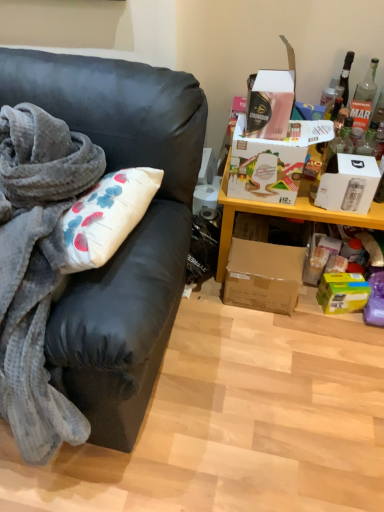
Question: Is white cardboard box at upper right, which is the 4th box from bottom to top, thinner than green matte box at lower right, which is the 4th box in top-to-bottom order?

Choices:
 (A) no
 (B) yes

Answer: (A)

Question: From the image's perspective, is white cardboard box at upper right, which is the 4th box from bottom to top, located beneath green matte box at lower right, which ranks as the 1th box in bottom-to-top order?

Choices:
 (A) no
 (B) yes

Answer: (A)

Question: Is green matte box at lower right, which ranks as the 1th box in bottom-to-top order, surrounded by white cardboard box at upper right, which is counted as the first box, starting from the top?

Choices:
 (A) yes
 (B) no

Answer: (B)

Question: Considering the relative sizes of white cardboard box at upper right, which is the 4th box from bottom to top, and green matte box at lower right, which is the 4th box in top-to-bottom order, in the image provided, is white cardboard box at upper right, which is the 4th box from bottom to top, bigger than green matte box at lower right, which is the 4th box in top-to-bottom order,?

Choices:
 (A) yes
 (B) no

Answer: (A)

Question: From a real-world perspective, is white cardboard box at upper right, which is counted as the first box, starting from the top, physically below green matte box at lower right, which ranks as the 1th box in bottom-to-top order?

Choices:
 (A) no
 (B) yes

Answer: (A)

Question: In the image, is white cardboard box at upper right, which is the 4th box from bottom to top, on the left side or the right side of matte black couch at left?

Choices:
 (A) right
 (B) left

Answer: (A)

Question: Looking at their shapes, would you say white cardboard box at upper right, which is counted as the first box, starting from the top, is wider or thinner than matte black couch at left?

Choices:
 (A) thin
 (B) wide

Answer: (A)

Question: From a real-world perspective, is white cardboard box at upper right, which is the 4th box from bottom to top, positioned above or below matte black couch at left?

Choices:
 (A) below
 (B) above

Answer: (B)

Question: Is white cardboard box at upper right, which is counted as the first box, starting from the top, inside or outside of matte black couch at left?

Choices:
 (A) outside
 (B) inside

Answer: (A)

Question: Considering the positions of brown cardboard box at lower right, acting as the second box starting from the bottom, and yellow wood shelf at upper right in the image, is brown cardboard box at lower right, acting as the second box starting from the bottom, wider or thinner than yellow wood shelf at upper right?

Choices:
 (A) wide
 (B) thin

Answer: (B)

Question: Which is correct: brown cardboard box at lower right, the third box when ordered from top to bottom, is inside yellow wood shelf at upper right, or outside of it?

Choices:
 (A) inside
 (B) outside

Answer: (A)

Question: In the image, is brown cardboard box at lower right, the third box when ordered from top to bottom, positioned in front of or behind yellow wood shelf at upper right?

Choices:
 (A) front
 (B) behind

Answer: (B)

Question: In terms of size, does brown cardboard box at lower right, the third box when ordered from top to bottom, appear bigger or smaller than yellow wood shelf at upper right?

Choices:
 (A) big
 (B) small

Answer: (B)

Question: From a real-world perspective, relative to white cardboard box at upper right, which is the 4th box from bottom to top, is matte black couch at left vertically above or below?

Choices:
 (A) above
 (B) below

Answer: (B)

Question: Is matte black couch at left taller or shorter than white cardboard box at upper right, which is counted as the first box, starting from the top?

Choices:
 (A) tall
 (B) short

Answer: (A)